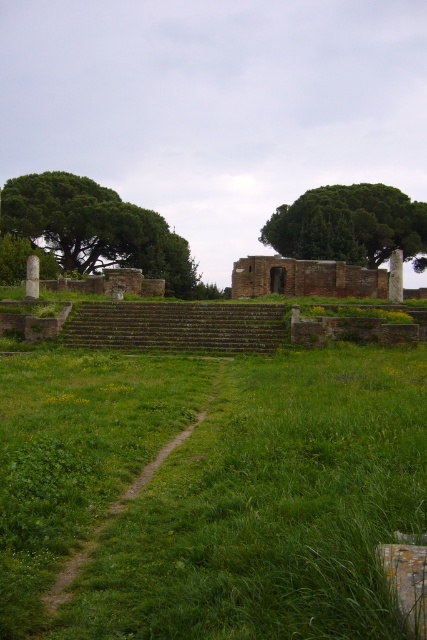
Question: Is green leafy tree at left below green leafy tree at upper center?

Choices:
 (A) no
 (B) yes

Answer: (B)

Question: Can you confirm if green grassy field at center is wider than green grassy path at center?

Choices:
 (A) no
 (B) yes

Answer: (B)

Question: Considering the real-world distances, which object is closest to the green leafy tree at upper center?

Choices:
 (A) green leafy tree at left
 (B) green grassy path at center
 (C) green grassy field at center

Answer: (A)

Question: Which of the following is the farthest from the observer?

Choices:
 (A) (210, 358)
 (B) (342, 212)
 (C) (211, 474)

Answer: (B)

Question: Is the position of green leafy tree at upper center more distant than that of green grassy path at center?

Choices:
 (A) yes
 (B) no

Answer: (A)

Question: Which point is closer to the camera taking this photo?

Choices:
 (A) (190, 433)
 (B) (357, 188)
 (C) (145, 221)

Answer: (A)